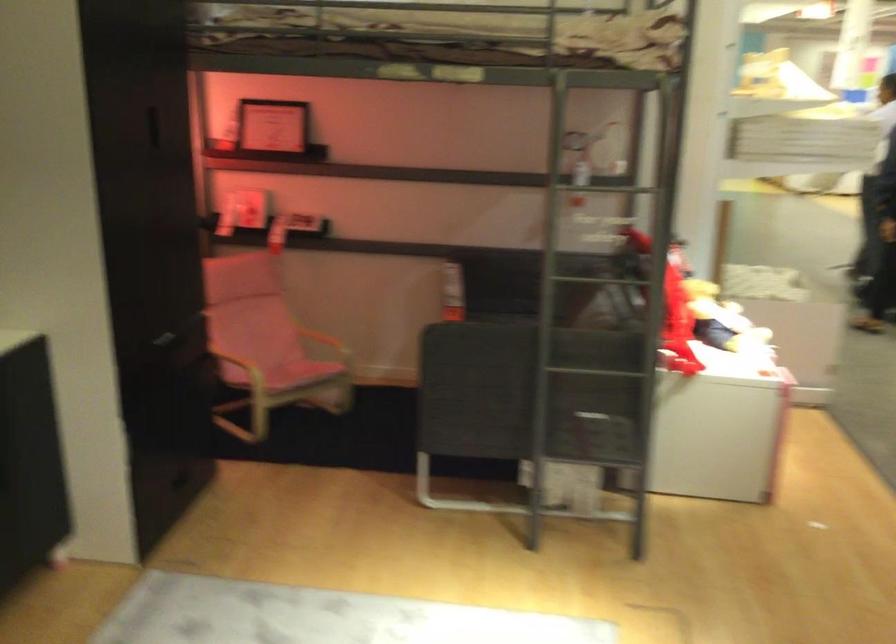
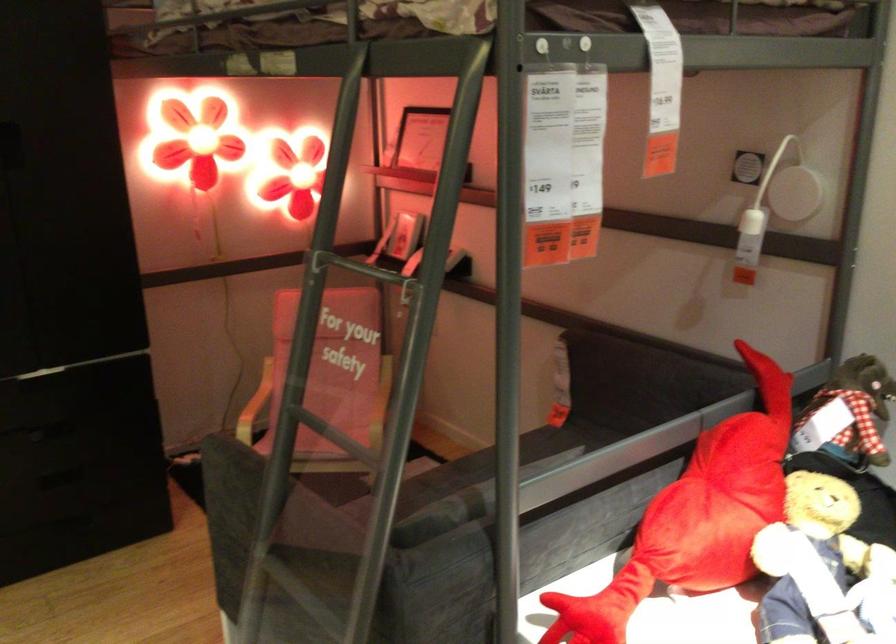
In the second image, find the point that corresponds to [630,283] in the first image.

(340, 448)